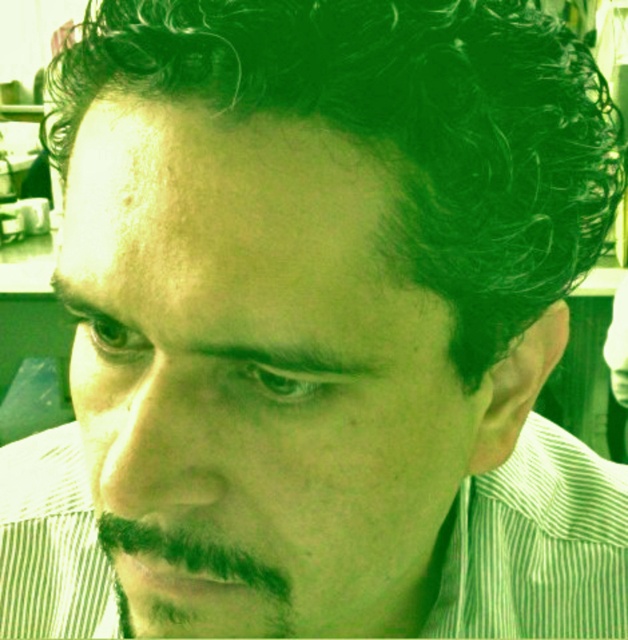
Describe the element at coordinates (401, 125) in the screenshot. The height and width of the screenshot is (640, 628). I see `dark curly hair at upper center` at that location.

Which is more to the left, dark curly hair at upper center or dark brown fuzzy beard at lower left?

Positioned to the left is dark curly hair at upper center.

Measure the distance between point (492, 36) and camera.

Point (492, 36) is 10.67 inches from camera.

Identify the location of dark curly hair at upper center. This screenshot has height=640, width=628. (401, 125).